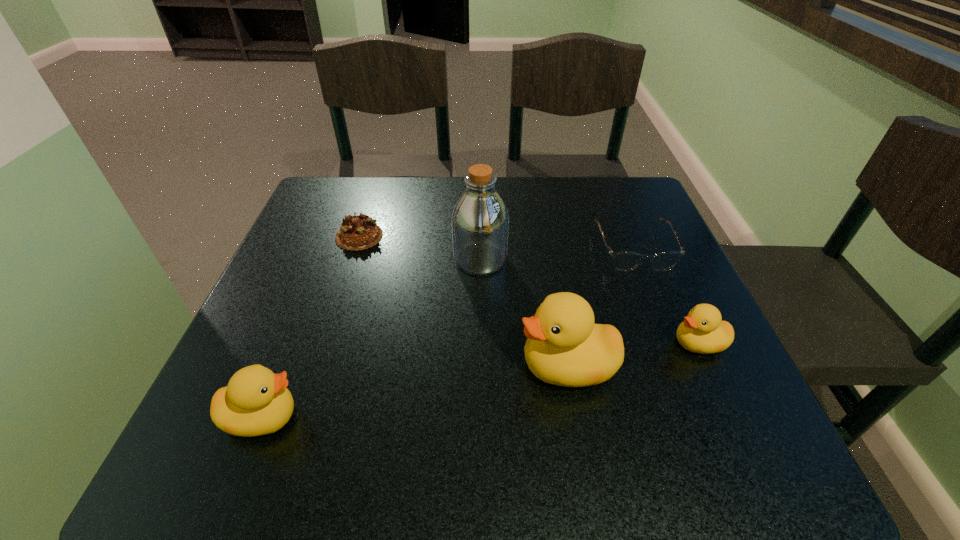
This screenshot has width=960, height=540. Find the location of `vacant position for inserting another duckling evenly`. vacant position for inserting another duckling evenly is located at coordinates (422, 390).